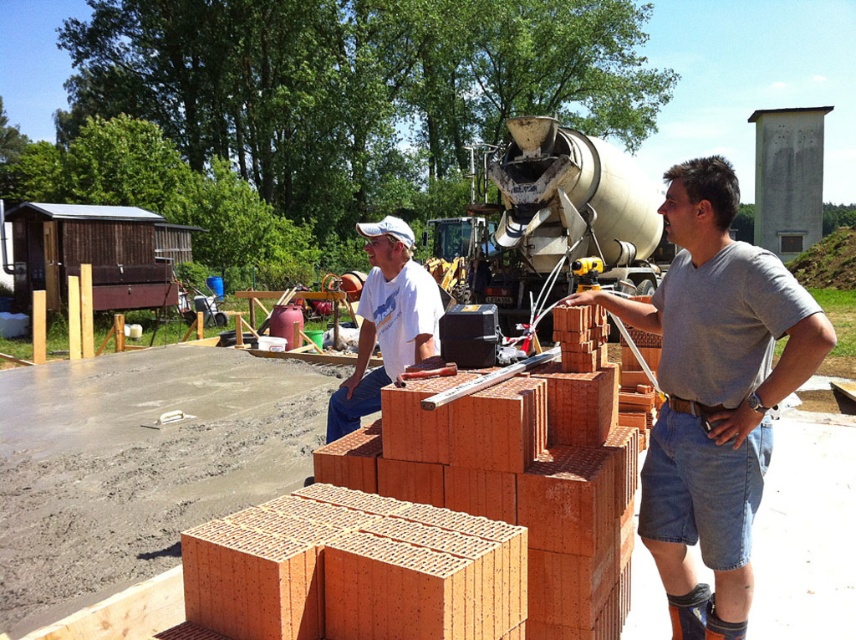
Consider the image. You are a surveyor at the construction site and need to determine the relative positions of two points marked on the blueprint. The first point is labeled as point (158, 506) and the second is point (679, 378). According to the scene description, which point is located behind the other?

Based on the scene description, point (158, 506) is behind point (679, 378).